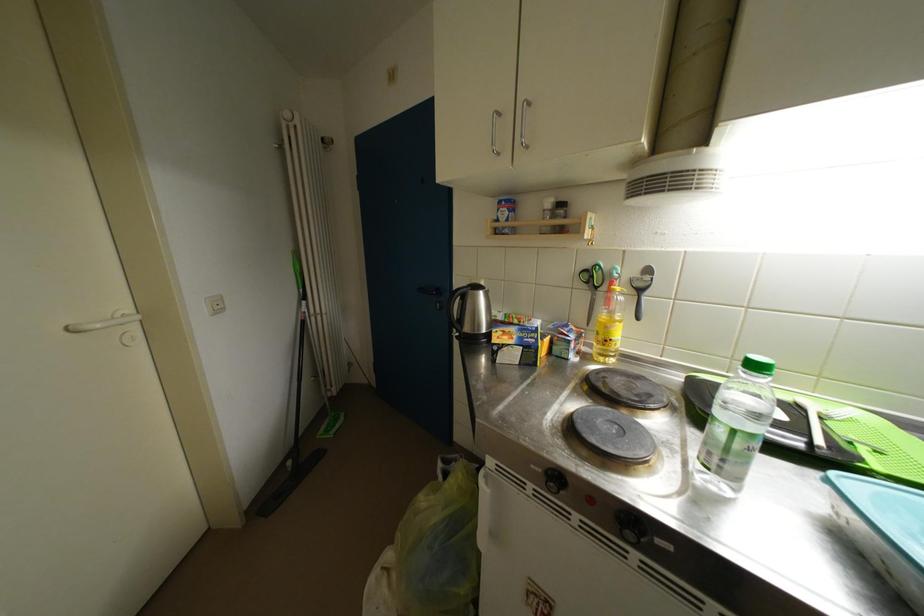
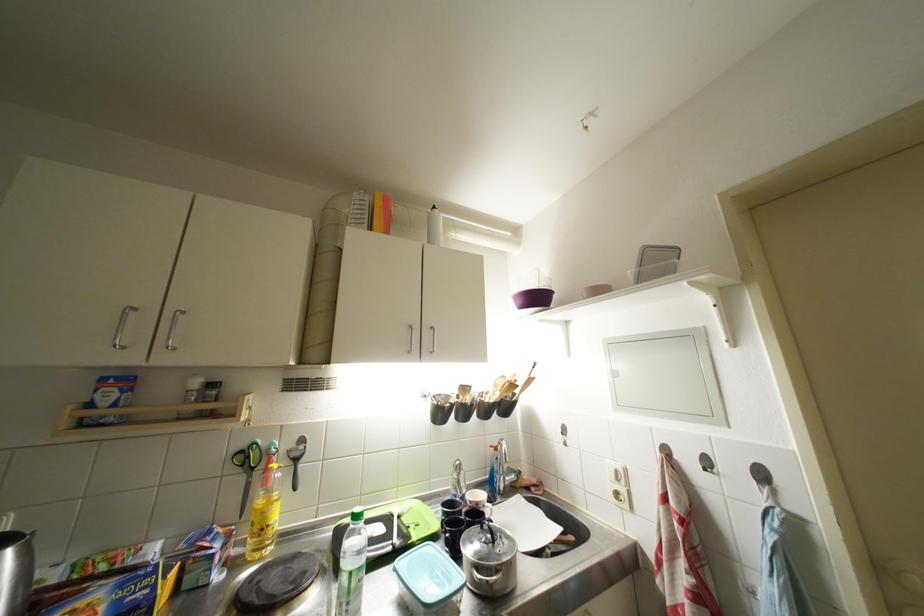
The point at (614,331) is marked in the first image. Where is the corresponding point in the second image?

(271, 517)